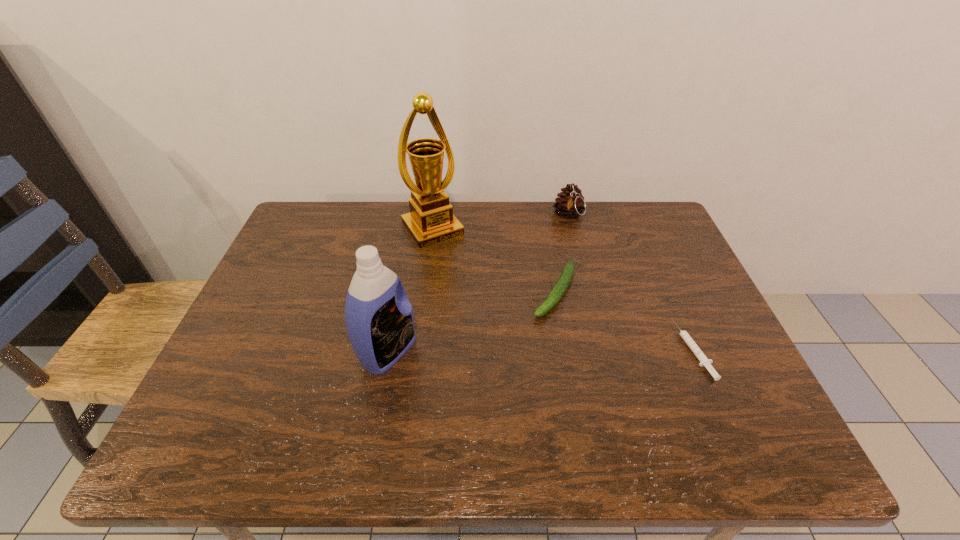
Where is `vacant spot on the desktop that is between the second tallest object and the shortest object and is positioned on the front-facing side of the tallest object`? vacant spot on the desktop that is between the second tallest object and the shortest object and is positioned on the front-facing side of the tallest object is located at coordinates (523, 350).

I want to click on free spot on the desktop that is between the fourth shortest object and the shortest object and is positioned on the front-facing side of the fourth tallest object, so click(x=516, y=351).

The image size is (960, 540). Find the location of `free space on the desktop that is between the second tallest object and the shortest object and is positioned with a leaf charm attached to the third shortest object`. free space on the desktop that is between the second tallest object and the shortest object and is positioned with a leaf charm attached to the third shortest object is located at coordinates (586, 350).